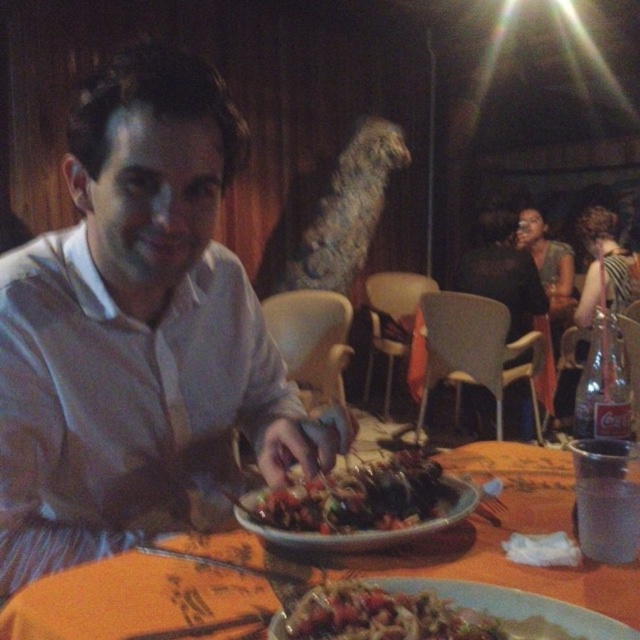
Based on the photo, you are a server in a restaurant and need to place a new drink on the table. The drink is 10 cm tall. There is space between the matte white shirt at center and the matte ceramic plate at center. Can the drink be placed there without touching either object?

The matte white shirt at center is taller than the matte ceramic plate at center. Since the drink is only 10 cm tall, it can be placed in the space between them without touching either object as the vertical clearance is sufficient.

Based on the photo, you are a waiter in a restaurant and need to deliver a drink to the customer seated at the table. The customer is wearing a matte white shirt at center and has a matte ceramic plate at center in front of them. Where should you place the drink to avoid obstructing their view of the plate?

The matte ceramic plate at center is behind the matte white shirt at center, so placing the drink to the side of the matte white shirt at center would avoid blocking the view of the plate.